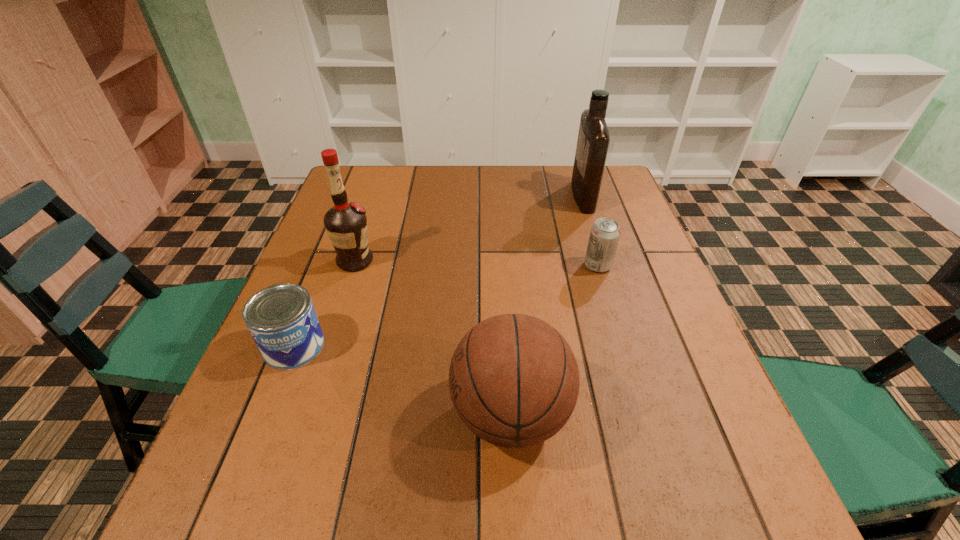
Locate an element on the screen. This screenshot has width=960, height=540. free space located on the front and back of the left liquor is located at coordinates (448, 261).

I want to click on free space located 0.210m on the side with brand label of the third shortest object, so (337, 414).

At what (x,y) coordinates should I click in order to perform the action: click on free spot located 0.270m on the side with brand label of the third shortest object. Please return your answer as a coordinate pair (x, y). Looking at the image, I should click on (304, 414).

Identify the location of free region located on the side with brand label of the third shortest object. Image resolution: width=960 pixels, height=540 pixels. (348, 414).

Locate an element on the screen. The image size is (960, 540). free space located on the left of the soda can is located at coordinates (462, 266).

Locate an element on the screen. The width and height of the screenshot is (960, 540). free spot located on the front label of the can is located at coordinates (262, 426).

This screenshot has height=540, width=960. What are the coordinates of `object at the far edge` in the screenshot? It's located at (593, 140).

The height and width of the screenshot is (540, 960). I want to click on liquor present at the left edge, so click(x=346, y=224).

This screenshot has width=960, height=540. In order to click on can that is at the left edge in this screenshot , I will do `click(282, 320)`.

Find the location of `liquor present at the right edge`. liquor present at the right edge is located at coordinates (593, 140).